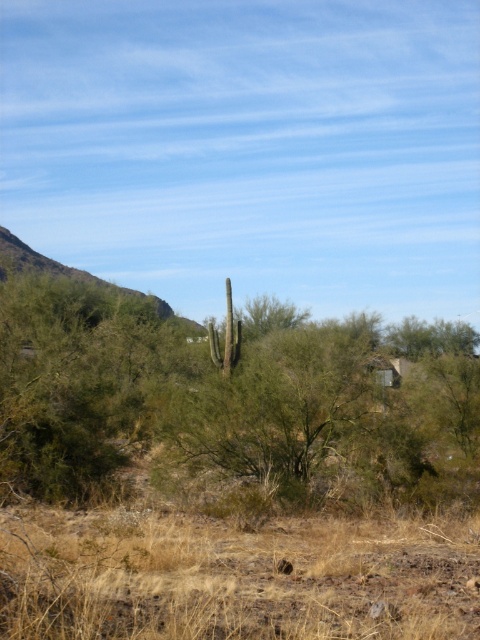
In the scene shown: Does green leafy tree at center have a larger size compared to brown dry grass at center?

Indeed, green leafy tree at center has a larger size compared to brown dry grass at center.

Can you confirm if green leafy tree at center is positioned to the left of brown dry grass at center?

Indeed, green leafy tree at center is positioned on the left side of brown dry grass at center.

Find the location of a particular element. green leafy tree at center is located at coordinates (229, 401).

Where is `green leafy tree at center`? green leafy tree at center is located at coordinates (229, 401).